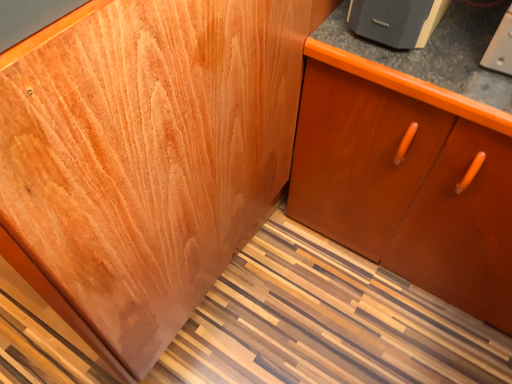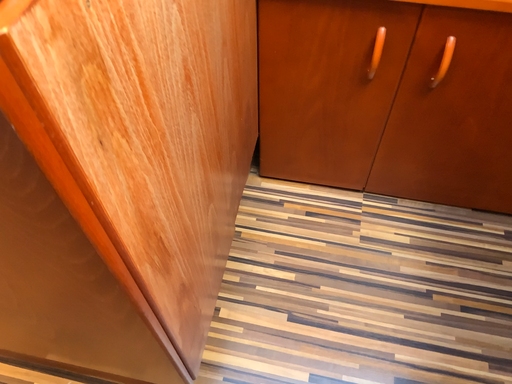
Question: How did the camera likely rotate when shooting the video?

Choices:
 (A) rotated left
 (B) rotated right

Answer: (B)